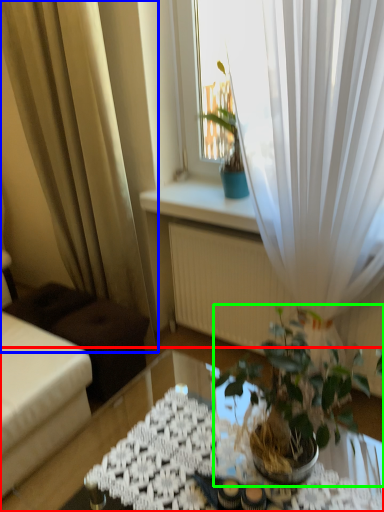
Question: Which object is the farthest from table (highlighted by a red box)? Choose among these: curtain (highlighted by a blue box) or houseplant (highlighted by a green box).

Choices:
 (A) curtain
 (B) houseplant

Answer: (A)